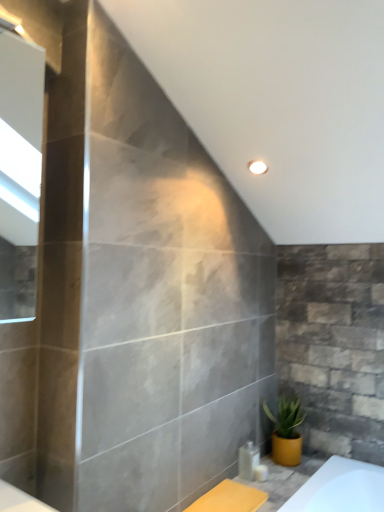
Question: Is white glossy soap dispenser at lower center, the 1th toiletry in the right-to-left sequence, to the left of clear plastic bottle at lower right, which is counted as the second toiletry, starting from the right, from the viewer's perspective?

Choices:
 (A) no
 (B) yes

Answer: (A)

Question: Is white glossy soap dispenser at lower center, which is the second toiletry in left-to-right order, far from clear plastic bottle at lower right, the 1th toiletry from the left?

Choices:
 (A) no
 (B) yes

Answer: (A)

Question: Is white glossy soap dispenser at lower center, which is the second toiletry in left-to-right order, next to clear plastic bottle at lower right, the 1th toiletry from the left, and touching it?

Choices:
 (A) no
 (B) yes

Answer: (B)

Question: From a real-world perspective, is white glossy soap dispenser at lower center, the 1th toiletry in the right-to-left sequence, physically above clear plastic bottle at lower right, which is counted as the second toiletry, starting from the right?

Choices:
 (A) no
 (B) yes

Answer: (A)

Question: Is white glossy soap dispenser at lower center, the 1th toiletry in the right-to-left sequence, at the right side of clear plastic bottle at lower right, the 1th toiletry from the left?

Choices:
 (A) no
 (B) yes

Answer: (B)

Question: Could you tell me if white glossy soap dispenser at lower center, the 1th toiletry in the right-to-left sequence, is facing clear plastic bottle at lower right, the 1th toiletry from the left?

Choices:
 (A) yes
 (B) no

Answer: (B)

Question: Is yellow matte pot at lower right shorter than white glossy soap dispenser at lower center, which is the second toiletry in left-to-right order?

Choices:
 (A) yes
 (B) no

Answer: (B)

Question: From a real-world perspective, is yellow matte pot at lower right on white glossy soap dispenser at lower center, which is the second toiletry in left-to-right order?

Choices:
 (A) yes
 (B) no

Answer: (A)

Question: From a real-world perspective, is yellow matte pot at lower right under white glossy soap dispenser at lower center, the 1th toiletry in the right-to-left sequence?

Choices:
 (A) no
 (B) yes

Answer: (A)

Question: Considering the relative sizes of yellow matte pot at lower right and white glossy soap dispenser at lower center, which is the second toiletry in left-to-right order, in the image provided, is yellow matte pot at lower right taller than white glossy soap dispenser at lower center, which is the second toiletry in left-to-right order,?

Choices:
 (A) yes
 (B) no

Answer: (A)

Question: Is yellow matte pot at lower right closer to the viewer compared to white glossy soap dispenser at lower center, which is the second toiletry in left-to-right order?

Choices:
 (A) yes
 (B) no

Answer: (B)

Question: Is yellow matte pot at lower right looking in the opposite direction of white glossy soap dispenser at lower center, the 1th toiletry in the right-to-left sequence?

Choices:
 (A) no
 (B) yes

Answer: (A)

Question: Does clear plastic bottle at lower right, which is counted as the second toiletry, starting from the right, come behind white glossy soap dispenser at lower center, which is the second toiletry in left-to-right order?

Choices:
 (A) no
 (B) yes

Answer: (B)